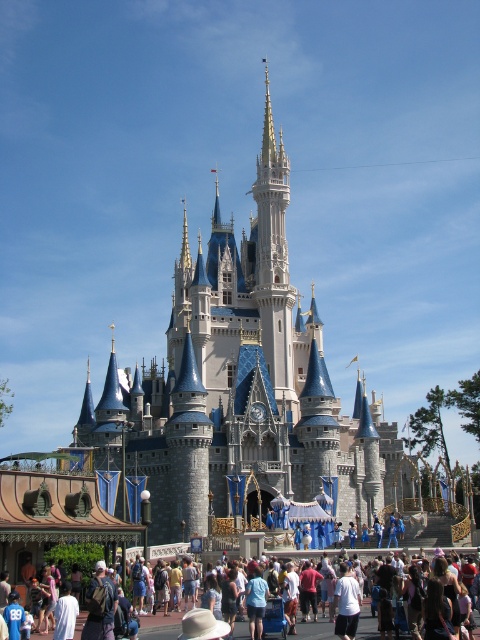
Where is `white stone castle at center`? Image resolution: width=480 pixels, height=640 pixels. white stone castle at center is located at coordinates (240, 385).

Which is below, white stone castle at center or multicolored casual attire at center?

Positioned lower is multicolored casual attire at center.

I want to click on white stone castle at center, so click(240, 385).

The width and height of the screenshot is (480, 640). I want to click on white stone castle at center, so click(240, 385).